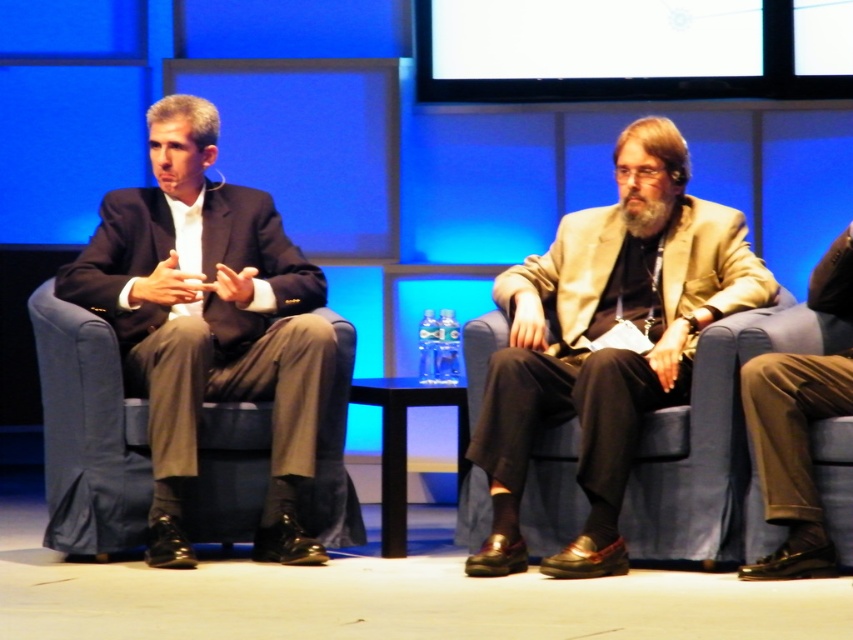
At what (x,y) coordinates should I click in order to perform the action: click on matte black suit at left. Please return your answer as a coordinate pair (x, y). Looking at the image, I should click on (209, 323).

Measure the distance between point (151, 170) and camera.

Point (151, 170) and camera are 5.70 meters apart.

Locate an element on the screen. The image size is (853, 640). matte black suit at left is located at coordinates (209, 323).

Between beige woolen blazer at center and brown leather pants at lower right, which one is positioned lower?

Positioned lower is brown leather pants at lower right.

Is point (622, 259) positioned in front of point (827, 264)?

No, (622, 259) is further to viewer.

Where is `beige woolen blazer at center`? beige woolen blazer at center is located at coordinates (606, 340).

Measure the distance between point (544, 564) and camera.

They are 3.86 meters apart.

This screenshot has height=640, width=853. Describe the element at coordinates (606, 340) in the screenshot. I see `beige woolen blazer at center` at that location.

Who is more forward, [622,442] or [189,216]?

Positioned in front is point [622,442].

At what (x,y) coordinates should I click in order to perform the action: click on beige woolen blazer at center. Please return your answer as a coordinate pair (x, y). Looking at the image, I should click on (606, 340).